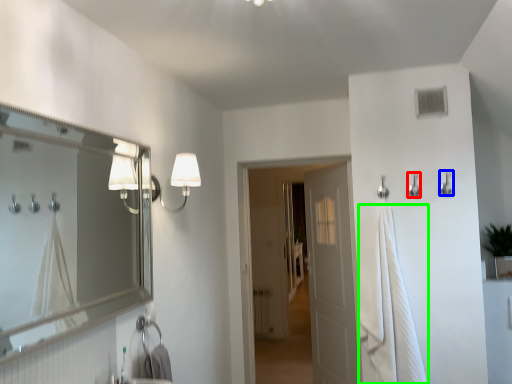
Question: Estimate the real-world distances between objects in this image. Which object is farther from shower (highlighted by a red box), shower (highlighted by a blue box) or bath towel (highlighted by a green box)?

Choices:
 (A) shower
 (B) bath towel

Answer: (B)